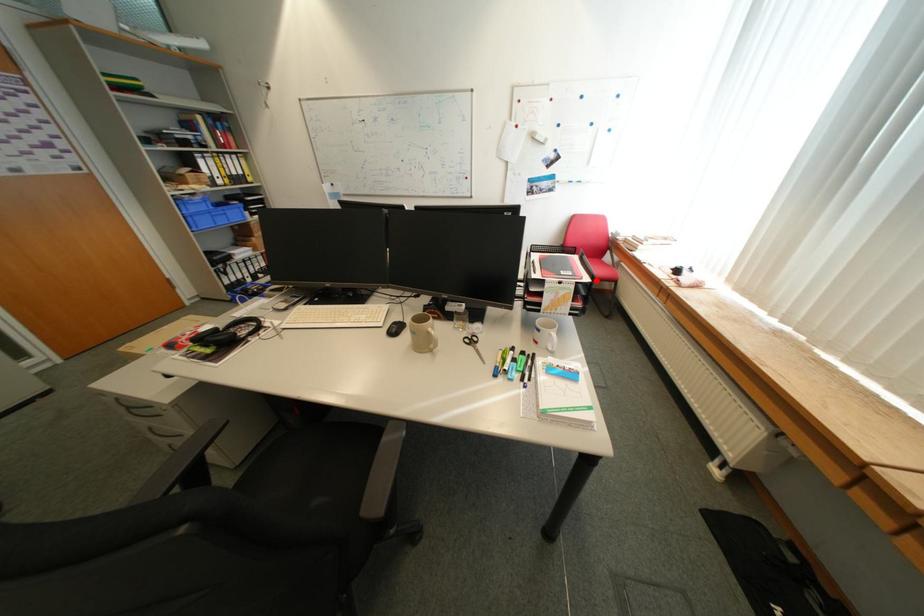
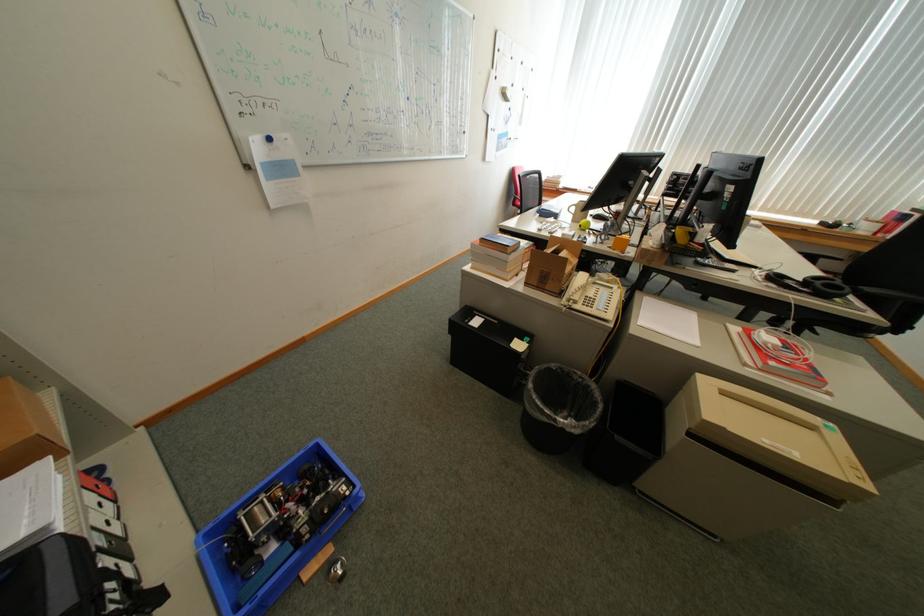
Question: I am providing you with two images of the same scene from different viewpoints. A red point is marked on the first image. Is the red point's position out of view in image 2?

Choices:
 (A) Yes
 (B) No

Answer: (A)